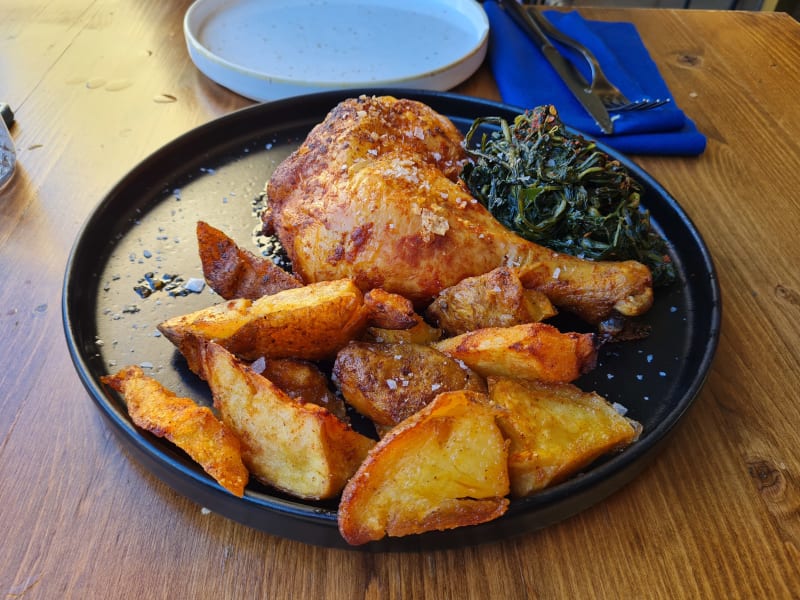
This screenshot has height=600, width=800. What are the coordinates of `white plate` in the screenshot? It's located at (386, 25).